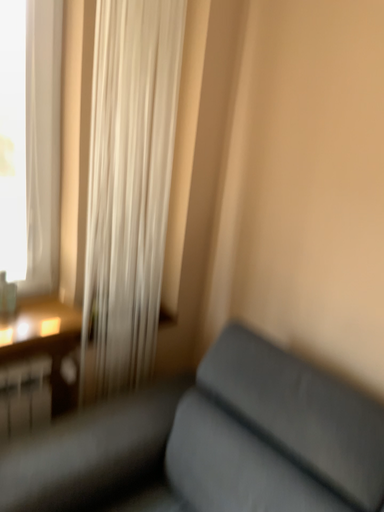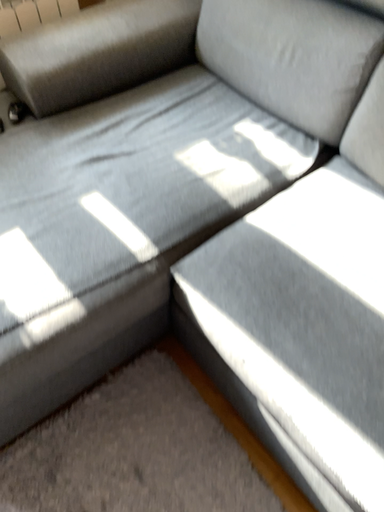
Question: Which way did the camera rotate in the video?

Choices:
 (A) rotated upward
 (B) rotated downward

Answer: (B)